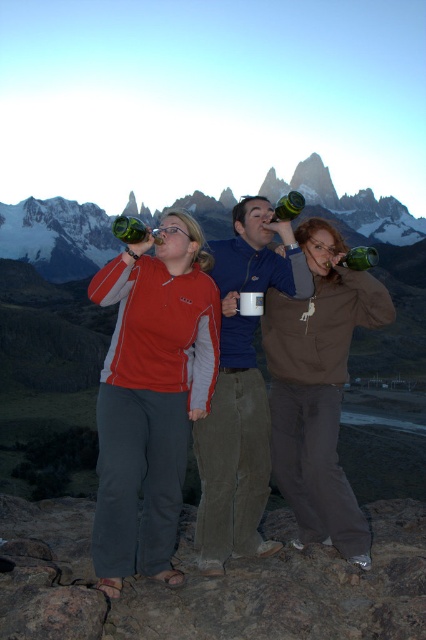
Question: Which point is closer to the camera?

Choices:
 (A) snowy granite mountain at upper center
 (B) green matte bottle at center
 (C) matte red jacket at center
 (D) blue fleece jacket at center

Answer: (C)

Question: Which of the following is the closest to the observer?

Choices:
 (A) (344, 260)
 (B) (117, 228)

Answer: (B)

Question: Can you confirm if matte brown jacket at center is positioned to the left of snowy granite mountain at upper center?

Choices:
 (A) yes
 (B) no

Answer: (B)

Question: Which object appears closest to the camera in this image?

Choices:
 (A) snowy granite mountain at upper center
 (B) matte red jacket at center

Answer: (B)

Question: Can you confirm if blue fleece jacket at center is positioned to the right of snowy granite mountain at upper center?

Choices:
 (A) yes
 (B) no

Answer: (B)

Question: Does blue fleece jacket at center have a larger size compared to green glass bottle at center?

Choices:
 (A) yes
 (B) no

Answer: (A)